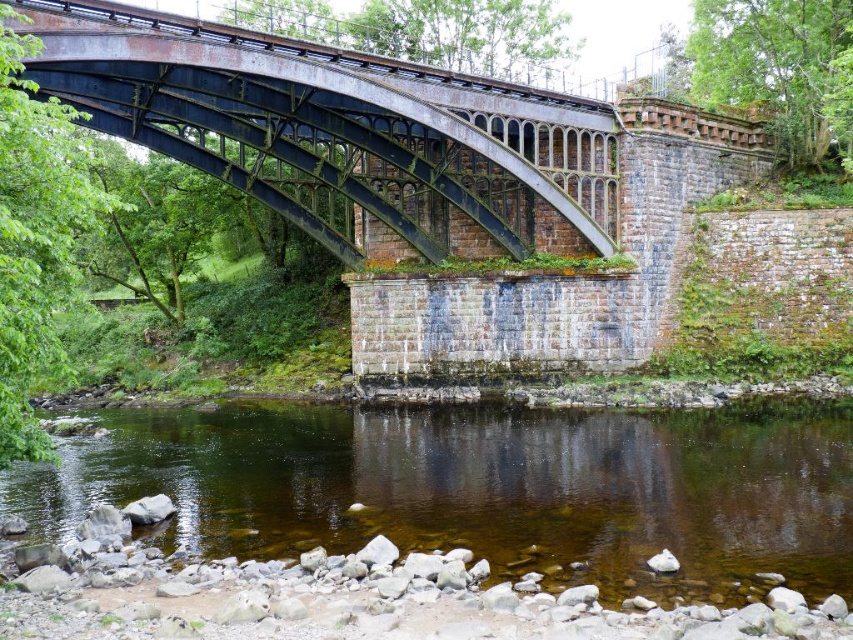
Question: Which point is closer to the camera?

Choices:
 (A) rusty metal arch bridge at center
 (B) clear water at center

Answer: (B)

Question: Which point is farther to the camera?

Choices:
 (A) rusty metal arch bridge at center
 (B) clear water at center

Answer: (A)

Question: Is clear water at center to the right of rusty metal arch bridge at center from the viewer's perspective?

Choices:
 (A) yes
 (B) no

Answer: (A)

Question: Does clear water at center have a smaller size compared to rusty metal arch bridge at center?

Choices:
 (A) no
 (B) yes

Answer: (B)

Question: Is clear water at center below rusty metal arch bridge at center?

Choices:
 (A) yes
 (B) no

Answer: (A)